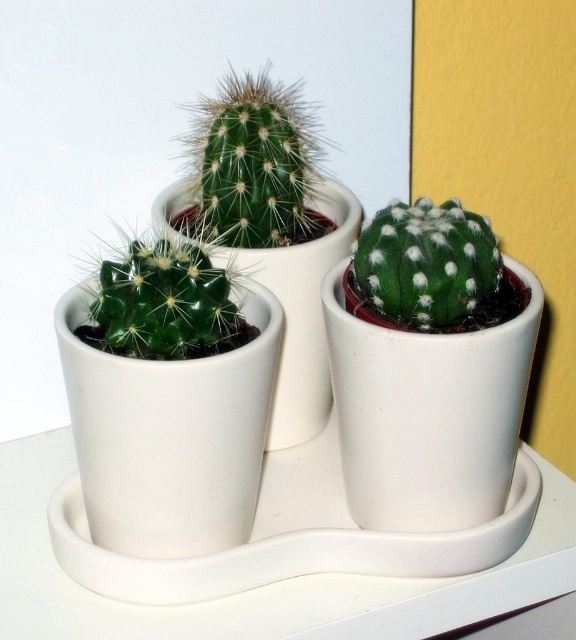
You are a delivery robot that needs to deliver a package to the green spiny cactus at center. Your maximum delivery range is 1 meter. Can you successfully deliver the package?

The green spiny cactus at center and camera are 1.05 meters apart from each other. Since your delivery range is 1 meter, you cannot reach the green spiny cactus at center.

From the picture: You are arranging plants on a shelf and have two green cacti in front of you. The green spiny cactus at center and the green matte cactus at center. You need to place them so the taller one is on the left side of the shelf. Which cactus should you place on the left?

The green spiny cactus at center is taller than the green matte cactus at center, so you should place the green spiny cactus at center on the left side of the shelf.